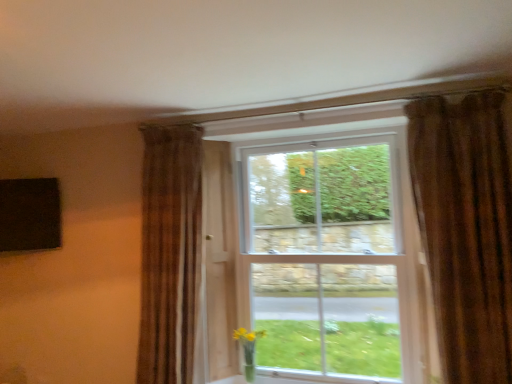
The image size is (512, 384). What do you see at coordinates (327, 256) in the screenshot?
I see `white glass window at center` at bounding box center [327, 256].

Where is `white glass window at center`? Image resolution: width=512 pixels, height=384 pixels. white glass window at center is located at coordinates (327, 256).

I want to click on brown textured curtain at left, which is the second curtain from front to back, so click(170, 252).

Locate an element on the screen. The width and height of the screenshot is (512, 384). translucent glass vase at lower right is located at coordinates (248, 349).

What do you see at coordinates (248, 349) in the screenshot? The image size is (512, 384). I see `translucent glass vase at lower right` at bounding box center [248, 349].

Find the location of a particular element. white glass window at center is located at coordinates (327, 256).

Do you think translucent glass vase at lower right is within white glass window at center, or outside of it?

The correct answer is: outside.

Which is more to the right, translucent glass vase at lower right or white glass window at center?

white glass window at center.

Is point (248, 382) positioned before point (358, 304)?

Yes, it is.

Between translucent glass vase at lower right and white glass window at center, which one is positioned in front?

Positioned in front is white glass window at center.

Which is less distant, (x=287, y=196) or (x=178, y=299)?

The point (x=178, y=299) is in front.

Would you say white glass window at center contains brown textured curtain at left, positioned as the first curtain in back-to-front order?

No, brown textured curtain at left, positioned as the first curtain in back-to-front order, is not inside white glass window at center.

Is white glass window at center bigger than brown textured curtain at left, positioned as the first curtain in back-to-front order?

Yes, white glass window at center is bigger than brown textured curtain at left, positioned as the first curtain in back-to-front order.

In the scene shown: Can you confirm if white glass window at center is positioned to the left of brown textured curtain at left, which is the second curtain from front to back?

In fact, white glass window at center is to the right of brown textured curtain at left, which is the second curtain from front to back.

Does translucent glass vase at lower right turn towards brown textured curtain at upper right, the first curtain viewed from the front?

No, translucent glass vase at lower right does not turn towards brown textured curtain at upper right, the first curtain viewed from the front.

Does translucent glass vase at lower right have a lesser height compared to brown textured curtain at upper right, which is the second curtain from back to front?

Correct, translucent glass vase at lower right is not as tall as brown textured curtain at upper right, which is the second curtain from back to front.

Which is in front, translucent glass vase at lower right or brown textured curtain at upper right, which is the second curtain from back to front?

brown textured curtain at upper right, which is the second curtain from back to front, is more forward.

Is the surface of translucent glass vase at lower right in direct contact with brown textured curtain at upper right, marked as the second curtain in a left-to-right arrangement?

translucent glass vase at lower right is not next to brown textured curtain at upper right, marked as the second curtain in a left-to-right arrangement, and they're not touching.

Is brown textured curtain at left, which appears as the second curtain when viewed from the right, thinner than brown textured curtain at upper right, the first curtain viewed from the front?

Correct, the width of brown textured curtain at left, which appears as the second curtain when viewed from the right, is less than that of brown textured curtain at upper right, the first curtain viewed from the front.

Is brown textured curtain at left, which is the second curtain from front to back, to the left of brown textured curtain at upper right, positioned as the first curtain in right-to-left order, from the viewer's perspective?

Indeed, brown textured curtain at left, which is the second curtain from front to back, is positioned on the left side of brown textured curtain at upper right, positioned as the first curtain in right-to-left order.

From the image's perspective, would you say brown textured curtain at left, which is the second curtain from front to back, is shown under brown textured curtain at upper right, positioned as the first curtain in right-to-left order?

Yes, from the image's perspective, brown textured curtain at left, which is the second curtain from front to back, is beneath brown textured curtain at upper right, positioned as the first curtain in right-to-left order.

What's the angular difference between brown textured curtain at left, which is the second curtain from front to back, and brown textured curtain at upper right, the first curtain viewed from the front,'s facing directions?

They differ by 0.872 degrees in their facing directions.

Is brown textured curtain at upper right, marked as the second curtain in a left-to-right arrangement, further to camera compared to white glass window at center?

No, it is in front of white glass window at center.

Based on their sizes in the image, would you say brown textured curtain at upper right, the first curtain viewed from the front, is bigger or smaller than white glass window at center?

brown textured curtain at upper right, the first curtain viewed from the front, is smaller than white glass window at center.

Find the location of a particular element. The image size is (512, 384). the 2nd curtain located above the white glass window at center (from a real-world perspective) is located at coordinates (466, 227).

Considering the relative positions of brown textured curtain at upper right, the first curtain viewed from the front, and white glass window at center in the image provided, is brown textured curtain at upper right, the first curtain viewed from the front, to the right of white glass window at center from the viewer's perspective?

Indeed, brown textured curtain at upper right, the first curtain viewed from the front, is positioned on the right side of white glass window at center.

Is brown textured curtain at left, which appears as the second curtain when viewed from the right, thinner than translucent glass vase at lower right?

No, brown textured curtain at left, which appears as the second curtain when viewed from the right, is not thinner than translucent glass vase at lower right.

Is point (163, 134) positioned in front of point (237, 338)?

That is True.

Is brown textured curtain at left, which appears as the second curtain when viewed from the right, situated inside translucent glass vase at lower right or outside?

brown textured curtain at left, which appears as the second curtain when viewed from the right, cannot be found inside translucent glass vase at lower right.

Based on the photo, which of these two, brown textured curtain at left, which is the second curtain from front to back, or translucent glass vase at lower right, stands taller?

With more height is brown textured curtain at left, which is the second curtain from front to back.

Relative to translucent glass vase at lower right, is brown textured curtain at upper right, positioned as the first curtain in right-to-left order, in front or behind?

In the image, brown textured curtain at upper right, positioned as the first curtain in right-to-left order, appears in front of translucent glass vase at lower right.

Is brown textured curtain at upper right, marked as the second curtain in a left-to-right arrangement, oriented away from translucent glass vase at lower right?

No, brown textured curtain at upper right, marked as the second curtain in a left-to-right arrangement, is not facing the opposite direction of translucent glass vase at lower right.

Is brown textured curtain at upper right, which is the second curtain from back to front, inside or outside of translucent glass vase at lower right?

brown textured curtain at upper right, which is the second curtain from back to front, is not inside translucent glass vase at lower right, it's outside.

Is brown textured curtain at upper right, positioned as the first curtain in right-to-left order, far from translucent glass vase at lower right?

That's right, there is a large distance between brown textured curtain at upper right, positioned as the first curtain in right-to-left order, and translucent glass vase at lower right.

In the image, there is a white glass window at center. Identify the location of floral arrangement below it (from a real-world perspective). [248, 349].

From the image's perspective, starting from the white glass window at center, which curtain is the 1st one above? Please provide its 2D coordinates.

[(170, 252)]

Looking at the image, which one is located further to white glass window at center, translucent glass vase at lower right or brown textured curtain at upper right, which is the second curtain from back to front?

The object further to white glass window at center is translucent glass vase at lower right.

Estimate the real-world distances between objects in this image. Which object is closer to brown textured curtain at upper right, the first curtain viewed from the front, white glass window at center or translucent glass vase at lower right?

Based on the image, white glass window at center appears to be nearer to brown textured curtain at upper right, the first curtain viewed from the front.

Looking at the image, which one is located further to brown textured curtain at left, which is the second curtain from front to back, white glass window at center or translucent glass vase at lower right?

white glass window at center is further to brown textured curtain at left, which is the second curtain from front to back.

Looking at the image, which one is located further to translucent glass vase at lower right, brown textured curtain at left, marked as the first curtain in a left-to-right arrangement, or brown textured curtain at upper right, the first curtain viewed from the front?

brown textured curtain at upper right, the first curtain viewed from the front, is further to translucent glass vase at lower right.

From the image, which object appears to be nearer to brown textured curtain at left, which is the second curtain from front to back, brown textured curtain at upper right, positioned as the first curtain in right-to-left order, or translucent glass vase at lower right?

translucent glass vase at lower right.

Which object lies further to the anchor point brown textured curtain at upper right, positioned as the first curtain in right-to-left order, translucent glass vase at lower right or brown textured curtain at left, marked as the first curtain in a left-to-right arrangement?

brown textured curtain at left, marked as the first curtain in a left-to-right arrangement, is further to brown textured curtain at upper right, positioned as the first curtain in right-to-left order.

Considering their positions, is translucent glass vase at lower right positioned closer to brown textured curtain at upper right, the first curtain viewed from the front, than white glass window at center?

Based on the image, white glass window at center appears to be nearer to brown textured curtain at upper right, the first curtain viewed from the front.

Estimate the real-world distances between objects in this image. Which object is further from brown textured curtain at left, marked as the first curtain in a left-to-right arrangement, translucent glass vase at lower right or white glass window at center?

The object further to brown textured curtain at left, marked as the first curtain in a left-to-right arrangement, is white glass window at center.

The image size is (512, 384). In order to click on floral arrangement located between brown textured curtain at left, positioned as the first curtain in back-to-front order, and brown textured curtain at upper right, which is the second curtain from back to front, in the left-right direction in this screenshot , I will do `click(248, 349)`.

Locate an element on the screen. The width and height of the screenshot is (512, 384). bay window located between brown textured curtain at left, marked as the first curtain in a left-to-right arrangement, and brown textured curtain at upper right, which is the second curtain from back to front, in the left-right direction is located at coordinates (327, 256).

Where is `bay window between translucent glass vase at lower right and brown textured curtain at upper right, marked as the second curtain in a left-to-right arrangement, in the horizontal direction`? The image size is (512, 384). bay window between translucent glass vase at lower right and brown textured curtain at upper right, marked as the second curtain in a left-to-right arrangement, in the horizontal direction is located at coordinates (327, 256).

Identify the location of floral arrangement between brown textured curtain at left, positioned as the first curtain in back-to-front order, and white glass window at center. (248, 349).